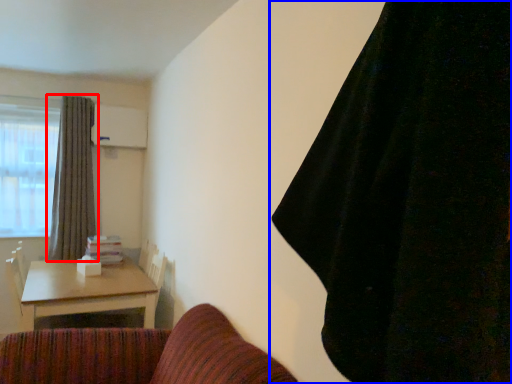
Question: Which object appears farthest to the camera in this image, curtain (highlighted by a red box) or curtain (highlighted by a blue box)?

Choices:
 (A) curtain
 (B) curtain

Answer: (A)